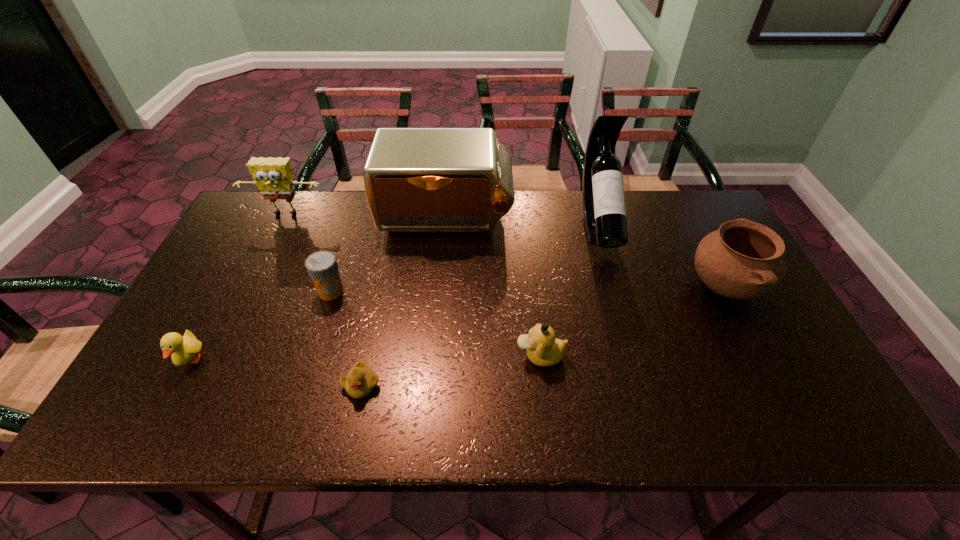
Find the location of `wine bottle that is at the far edge`. wine bottle that is at the far edge is located at coordinates (604, 213).

Locate an element on the screen. This screenshot has height=540, width=960. toaster oven situated at the far edge is located at coordinates (416, 179).

Locate an element on the screen. sponge located at the far edge is located at coordinates point(273,176).

Find the location of a particular element. The width and height of the screenshot is (960, 540). object that is positioned at the near edge is located at coordinates (360, 381).

You are a GUI agent. You are given a task and a screenshot of the screen. Output one action in this format:
    pyautogui.click(x=<x>, y=<y>)
    Task: Click on the sponge positioned at the left edge
    This screenshot has height=540, width=960.
    Given the screenshot: What is the action you would take?
    pyautogui.click(x=273, y=176)

Identify the location of duckling present at the left edge. (183, 349).

This screenshot has height=540, width=960. Find the location of `object that is at the right edge`. object that is at the right edge is located at coordinates click(742, 260).

Where is `object present at the far left corner`? object present at the far left corner is located at coordinates (273, 176).

Image resolution: width=960 pixels, height=540 pixels. What are the coordinates of `vacant region at the far edge of the desktop` in the screenshot? It's located at (x=575, y=191).

In the image, there is a desktop. Identify the location of vacant space at the near edge. The width and height of the screenshot is (960, 540). (x=752, y=415).